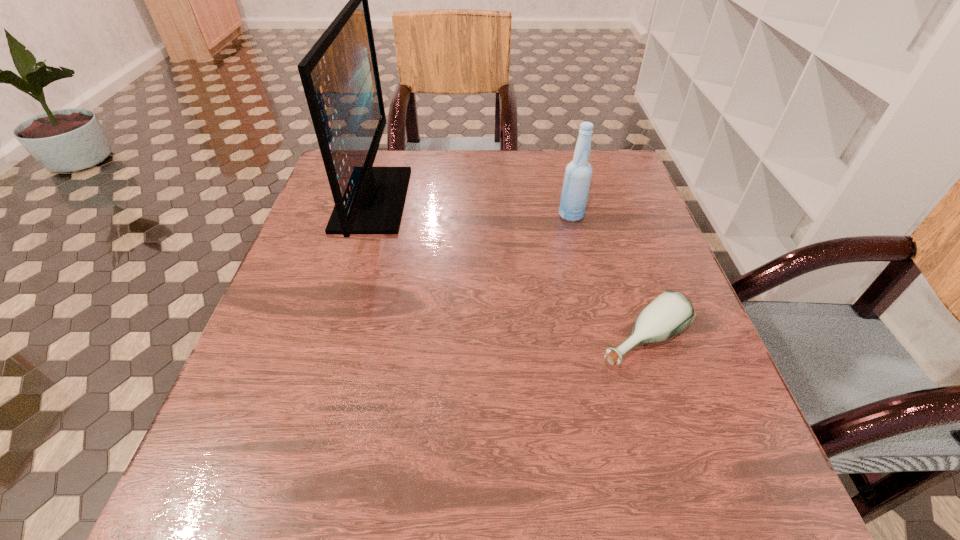
Where is `vacant region that satisfies the following two spatial constraints: 1. on the back side of the shorter bottle; 2. on the screen side of the leftmost object`? The image size is (960, 540). vacant region that satisfies the following two spatial constraints: 1. on the back side of the shorter bottle; 2. on the screen side of the leftmost object is located at coordinates (597, 199).

Find the location of a particular element. vacant space that satisfies the following two spatial constraints: 1. on the screen side of the nearest object; 2. on the right side of the monitor is located at coordinates (330, 340).

Locate an element on the screen. Image resolution: width=960 pixels, height=540 pixels. free spot that satisfies the following two spatial constraints: 1. on the screen side of the second tallest object; 2. on the right side of the tallest object is located at coordinates (368, 215).

You are a GUI agent. You are given a task and a screenshot of the screen. Output one action in this format:
    pyautogui.click(x=<x>, y=<y>)
    Task: Click on the vacant area in the image that satisfies the following two spatial constraints: 1. on the screen side of the tallest object; 2. on the back side of the second tallest object
    This screenshot has height=540, width=960.
    Given the screenshot: What is the action you would take?
    pyautogui.click(x=368, y=215)

Identify the location of vacant space that satisfies the following two spatial constraints: 1. on the screen side of the leftmost object; 2. on the back side of the taller bottle. The image size is (960, 540). (368, 215).

You are a GUI agent. You are given a task and a screenshot of the screen. Output one action in this format:
    pyautogui.click(x=<x>, y=<y>)
    Task: Click on the free point that satisfies the following two spatial constraints: 1. on the screen side of the nearer bottle; 2. on the left side of the monitor
    Image resolution: width=960 pixels, height=540 pixels.
    Given the screenshot: What is the action you would take?
    pyautogui.click(x=330, y=340)

Locate an element on the screen. Image resolution: width=960 pixels, height=540 pixels. free space that satisfies the following two spatial constraints: 1. on the screen side of the tallest object; 2. on the back side of the second tallest object is located at coordinates (368, 215).

The height and width of the screenshot is (540, 960). Identify the location of vacant region that satisfies the following two spatial constraints: 1. on the screen side of the tallest object; 2. on the right side of the second tallest object. (368, 215).

I want to click on vacant region that satisfies the following two spatial constraints: 1. on the screen side of the second tallest object; 2. on the right side of the monitor, so pos(368,215).

Identify the location of blank area in the image that satisfies the following two spatial constraints: 1. on the screen side of the leftmost object; 2. on the back side of the taller bottle. (368, 215).